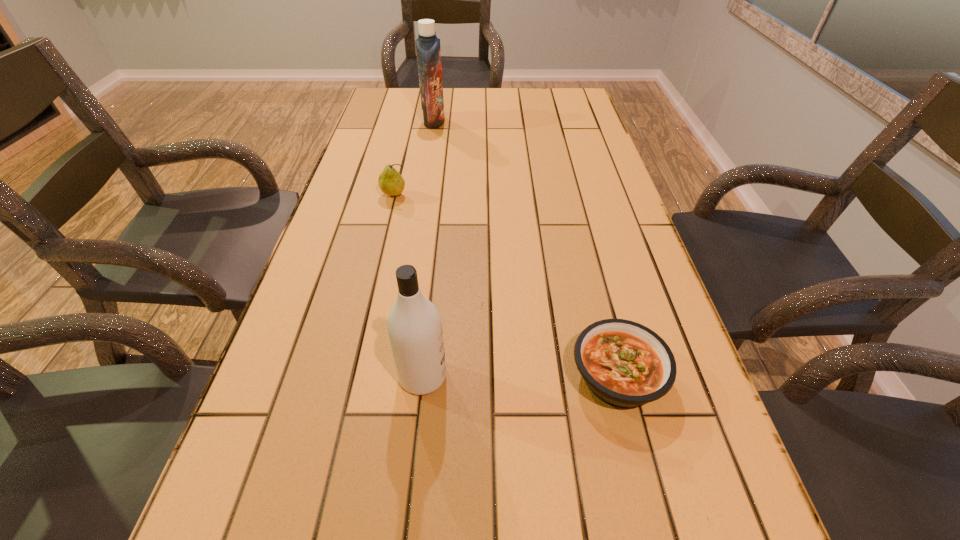
Identify the location of vacant point located on the back of the rightmost object. The image size is (960, 540). (588, 262).

Where is `object present at the far edge`? object present at the far edge is located at coordinates (428, 49).

The height and width of the screenshot is (540, 960). Find the location of `object that is at the left edge`. object that is at the left edge is located at coordinates (390, 181).

Image resolution: width=960 pixels, height=540 pixels. Find the location of `object that is at the right edge`. object that is at the right edge is located at coordinates (625, 364).

Where is `vacant space at the far edge of the desktop`? vacant space at the far edge of the desktop is located at coordinates (539, 107).

This screenshot has width=960, height=540. Find the location of `free location at the left edge of the desktop`. free location at the left edge of the desktop is located at coordinates (388, 221).

Locate an element on the screen. vacant area at the right edge of the desktop is located at coordinates (568, 212).

Locate an element on the screen. The image size is (960, 540). vacant region at the far left corner of the desktop is located at coordinates (378, 96).

The height and width of the screenshot is (540, 960). What are the coordinates of `vacant space at the far right corner` in the screenshot? It's located at (563, 109).

Image resolution: width=960 pixels, height=540 pixels. Find the location of `vacant area between the rightmost object and the shorter shampoo`. vacant area between the rightmost object and the shorter shampoo is located at coordinates (520, 376).